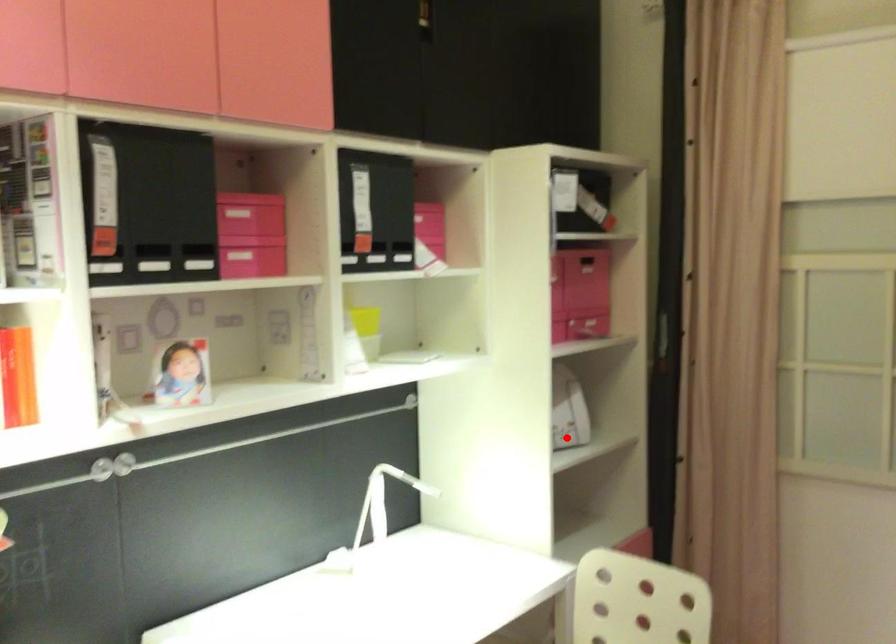
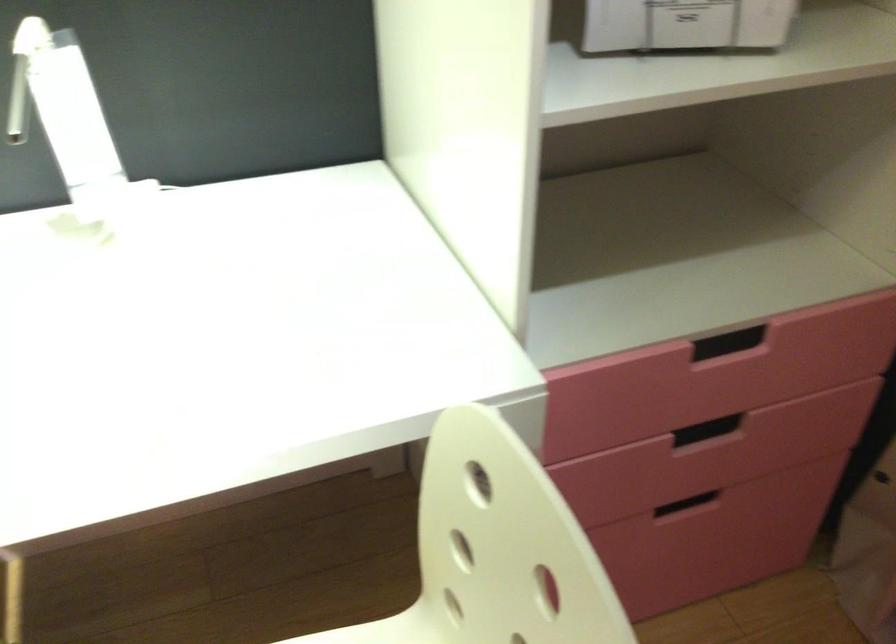
The point at the highlighted location is marked in the first image. Where is the corresponding point in the second image?

(685, 24)